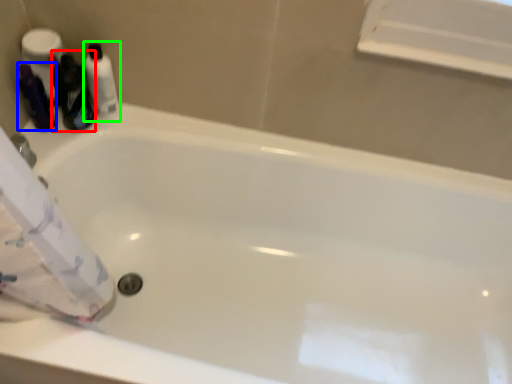
Question: Which object is positioned farthest from cleaning product (highlighted by a red box)? Select from toiletry (highlighted by a blue box) and toiletry (highlighted by a green box).

Choices:
 (A) toiletry
 (B) toiletry

Answer: (A)